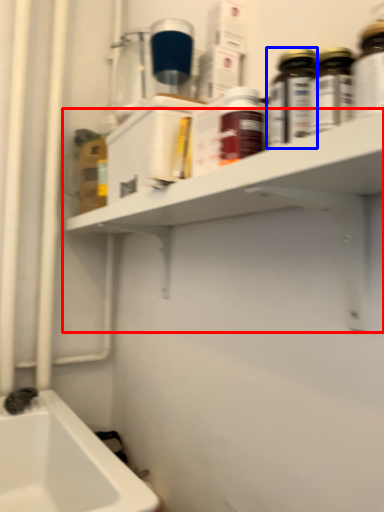
Question: Which point is closer to the camera, shelf (highlighted by a red box) or bottle (highlighted by a blue box)?

Choices:
 (A) shelf
 (B) bottle

Answer: (A)